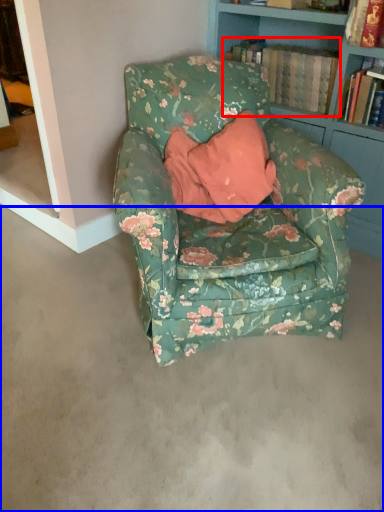
Question: Which point is closer to the camera, book (highlighted by a red box) or concrete (highlighted by a blue box)?

Choices:
 (A) book
 (B) concrete

Answer: (B)